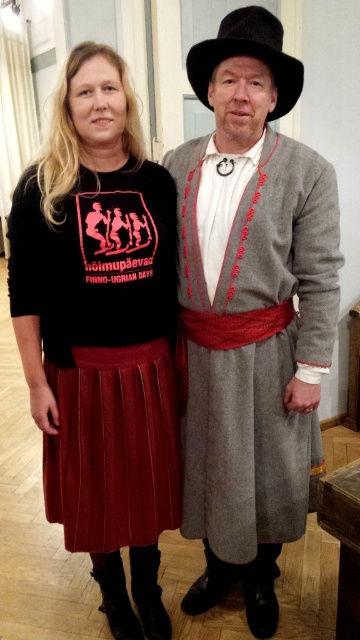
Question: Which object is the farthest from the burgundy pleated skirt at lower left?

Choices:
 (A) velvet skirt at center
 (B) black felt cowboy hat at upper center

Answer: (B)

Question: Can you confirm if velvet skirt at center is thinner than black felt cowboy hat at upper center?

Choices:
 (A) yes
 (B) no

Answer: (B)

Question: Which object is the farthest from the burgundy pleated skirt at lower left?

Choices:
 (A) velvet skirt at center
 (B) black felt cowboy hat at upper center

Answer: (B)

Question: Does burgundy pleated skirt at lower left have a smaller size compared to black felt cowboy hat at upper center?

Choices:
 (A) no
 (B) yes

Answer: (A)

Question: Does burgundy pleated skirt at lower left have a greater width compared to black felt cowboy hat at upper center?

Choices:
 (A) no
 (B) yes

Answer: (B)

Question: Which object is positioned farthest from the black felt cowboy hat at upper center?

Choices:
 (A) velvet skirt at center
 (B) burgundy pleated skirt at lower left

Answer: (B)